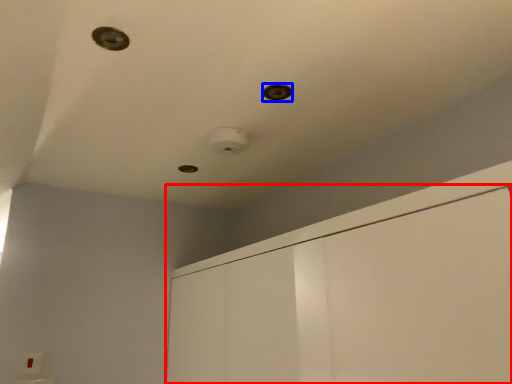
Question: Among these objects, which one is nearest to the camera, dresser (highlighted by a red box) or hole (highlighted by a blue box)?

Choices:
 (A) dresser
 (B) hole

Answer: (A)